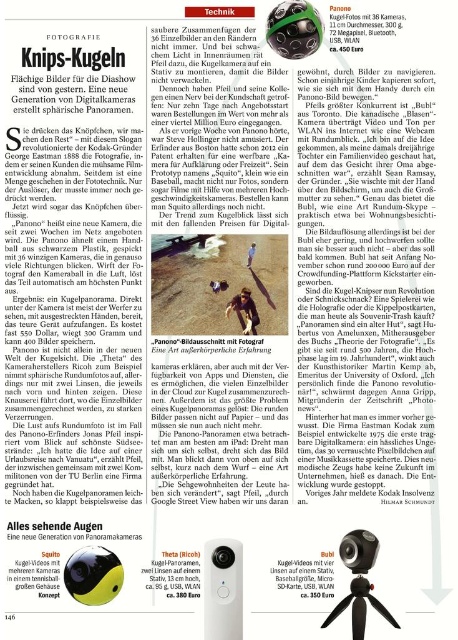
Can you confirm if white plastic kugel-kamera at center is positioned above black plastic webcam at center?

Incorrect, white plastic kugel-kamera at center is not positioned above black plastic webcam at center.

Consider the image. Can you confirm if white plastic kugel-kamera at center is bigger than black plastic webcam at center?

Correct, white plastic kugel-kamera at center is larger in size than black plastic webcam at center.

Which is in front, point (213, 621) or point (355, 561)?

Point (213, 621) is in front.

Identify the location of white plastic kugel-kamera at center. (223, 589).

Can you confirm if black plastic tripod at lower center is bigger than black plastic webcam at center?

Indeed, black plastic tripod at lower center has a larger size compared to black plastic webcam at center.

Is point (359, 604) positioned after point (343, 560)?

That is False.

Find the location of `black plastic tripod at lower center`. black plastic tripod at lower center is located at coordinates (359, 608).

Between point (239, 550) and point (325, 620), which one is positioned behind?

Positioned behind is point (239, 550).

Between white plastic kugel-kamera at center and black plastic tripod at lower center, which one appears on the left side from the viewer's perspective?

From the viewer's perspective, white plastic kugel-kamera at center appears more on the left side.

Measure the distance between point [238,637] and camera.

Point [238,637] is 3.84 feet from camera.

Identify the location of white plastic kugel-kamera at center. The height and width of the screenshot is (640, 458). (223, 589).